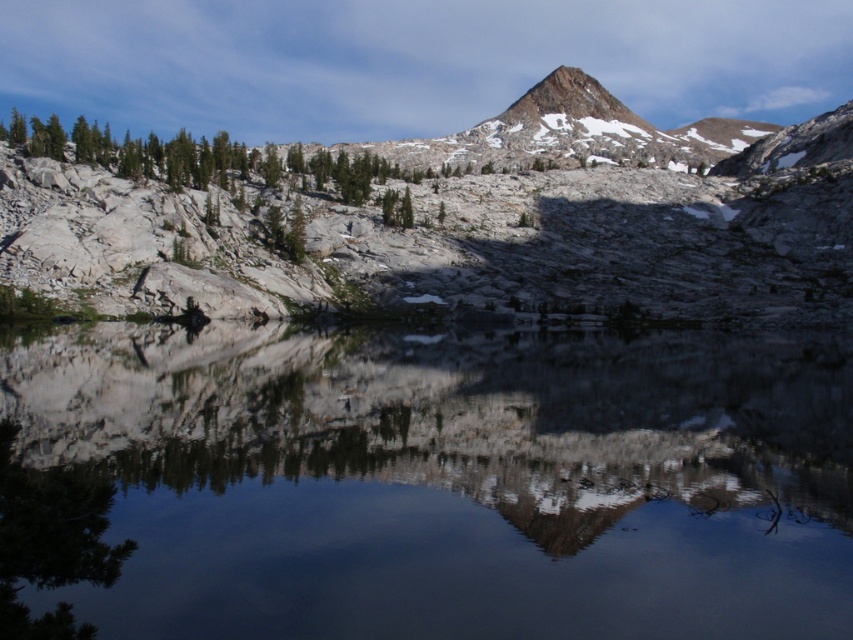
Question: Based on their relative distances, which object is farther from the green matte tree at lower left?

Choices:
 (A) rugged granite mountain at upper center
 (B) smooth reflective water at center

Answer: (A)

Question: Is smooth reflective water at center positioned behind green matte tree at lower left?

Choices:
 (A) no
 (B) yes

Answer: (B)

Question: Among these points, which one is farthest from the camera?

Choices:
 (A) (44, 545)
 (B) (670, 230)

Answer: (B)

Question: Is smooth reflective water at center further to the viewer compared to rugged granite mountain at upper center?

Choices:
 (A) yes
 (B) no

Answer: (B)

Question: Which is nearer to the green matte tree at lower left?

Choices:
 (A) smooth reflective water at center
 (B) rugged granite mountain at upper center

Answer: (A)

Question: Is smooth reflective water at center above green matte tree at lower left?

Choices:
 (A) yes
 (B) no

Answer: (A)